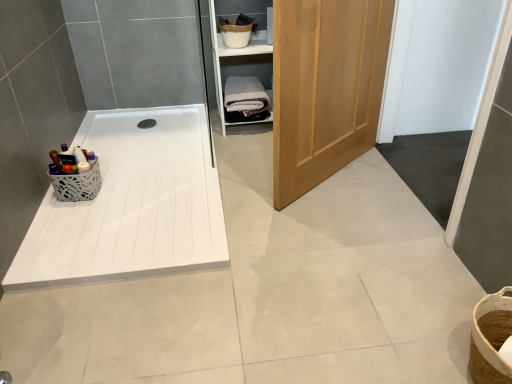
Question: From a real-world perspective, is white cotton bath towel at center physically below black rubber drain at center?

Choices:
 (A) yes
 (B) no

Answer: (B)

Question: Considering the relative sizes of white cotton bath towel at center and black rubber drain at center in the image provided, is white cotton bath towel at center taller than black rubber drain at center?

Choices:
 (A) no
 (B) yes

Answer: (B)

Question: Is white cotton bath towel at center bigger than black rubber drain at center?

Choices:
 (A) yes
 (B) no

Answer: (A)

Question: Would you say white cotton bath towel at center is a long distance from black rubber drain at center?

Choices:
 (A) yes
 (B) no

Answer: (B)

Question: Is white cotton bath towel at center to the left of black rubber drain at center from the viewer's perspective?

Choices:
 (A) no
 (B) yes

Answer: (A)

Question: Is the position of white cotton bath towel at center more distant than that of black rubber drain at center?

Choices:
 (A) no
 (B) yes

Answer: (A)

Question: Is white lace basket at left positioned before white cotton bath towel at center?

Choices:
 (A) no
 (B) yes

Answer: (B)

Question: Is white lace basket at left looking in the opposite direction of white cotton bath towel at center?

Choices:
 (A) no
 (B) yes

Answer: (A)

Question: Considering the relative sizes of white lace basket at left and white cotton bath towel at center in the image provided, is white lace basket at left wider than white cotton bath towel at center?

Choices:
 (A) yes
 (B) no

Answer: (B)

Question: Does white lace basket at left contain white cotton bath towel at center?

Choices:
 (A) yes
 (B) no

Answer: (B)

Question: From a real-world perspective, is white lace basket at left under white cotton bath towel at center?

Choices:
 (A) no
 (B) yes

Answer: (B)

Question: Is white lace basket at left not within white cotton bath towel at center?

Choices:
 (A) yes
 (B) no

Answer: (A)

Question: Is black rubber drain at center shorter than wooden cabinet at upper right?

Choices:
 (A) yes
 (B) no

Answer: (A)